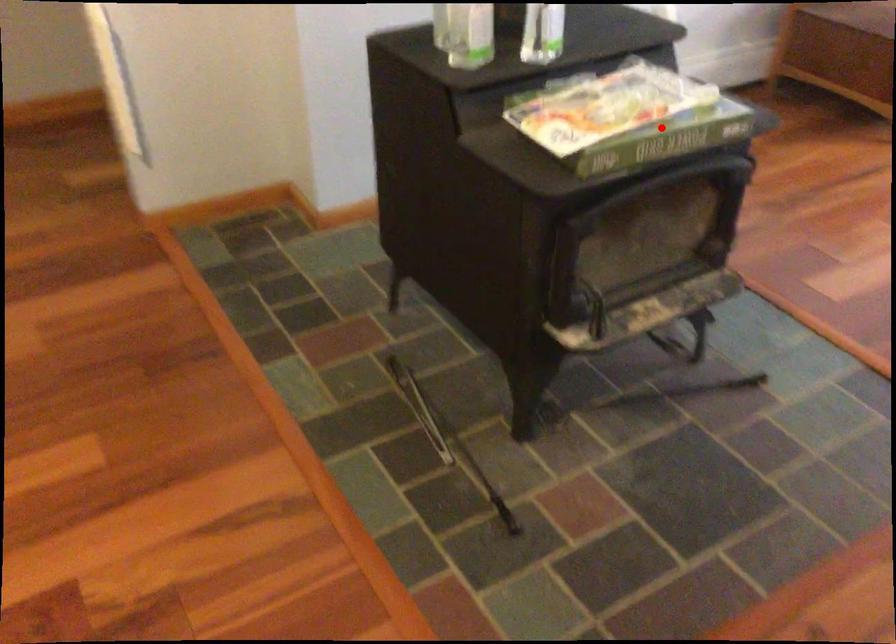
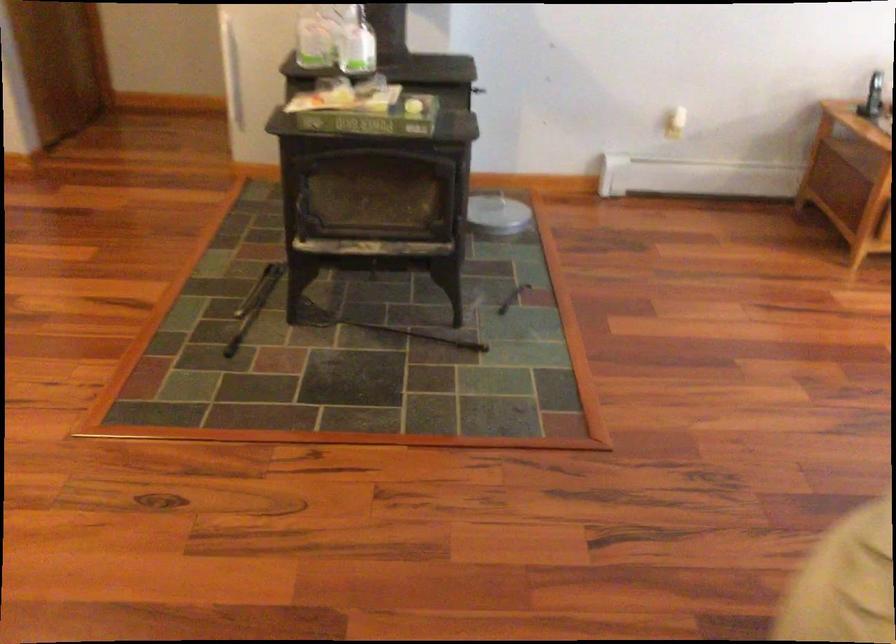
Question: A red point is marked in image1. In image2, is the corresponding 3D point closer to the camera or farther? Reply with the corresponding letter.

Choices:
 (A) The corresponding 3D point is closer.
 (B) The corresponding 3D point is farther.

Answer: (B)